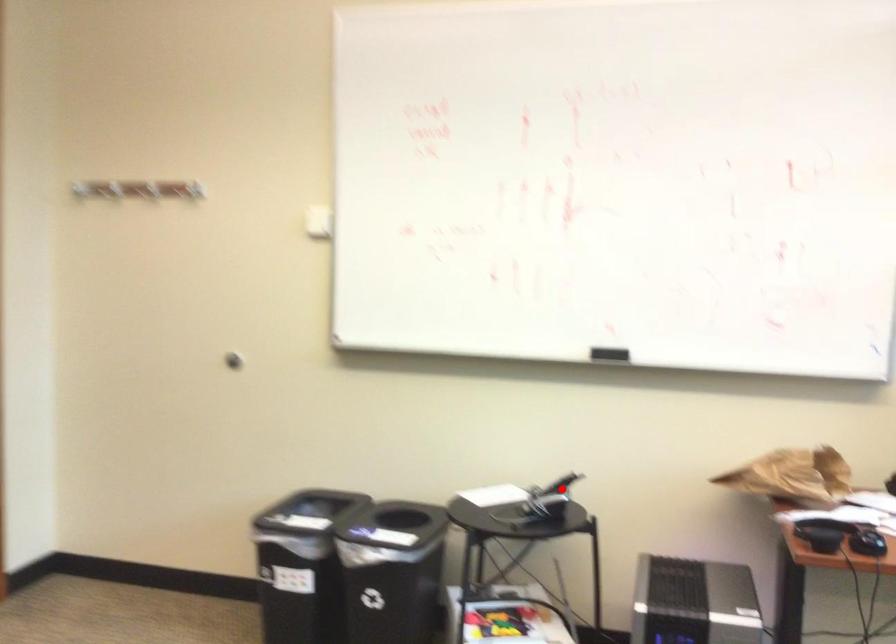
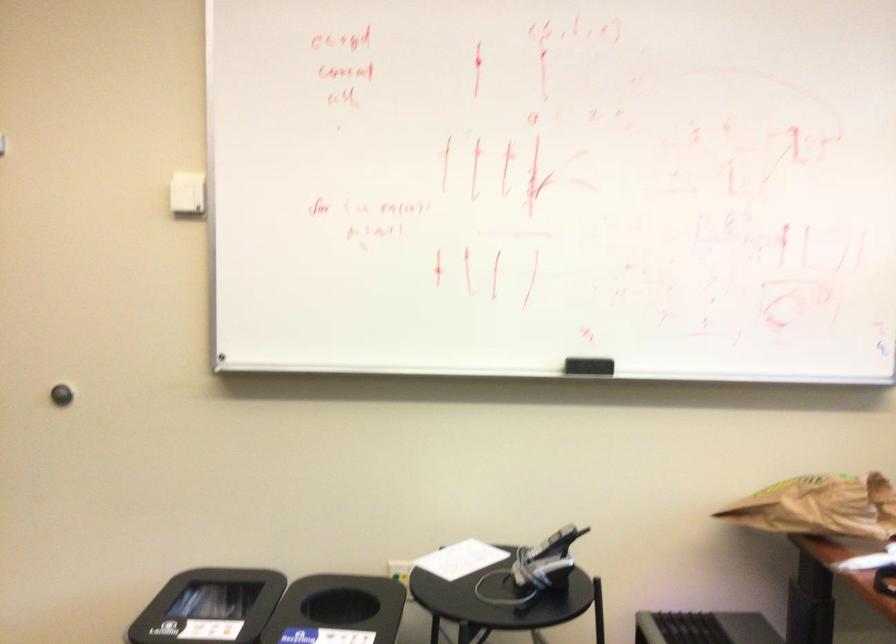
The point at the highlighted location is marked in the first image. Where is the corresponding point in the second image?

(552, 544)